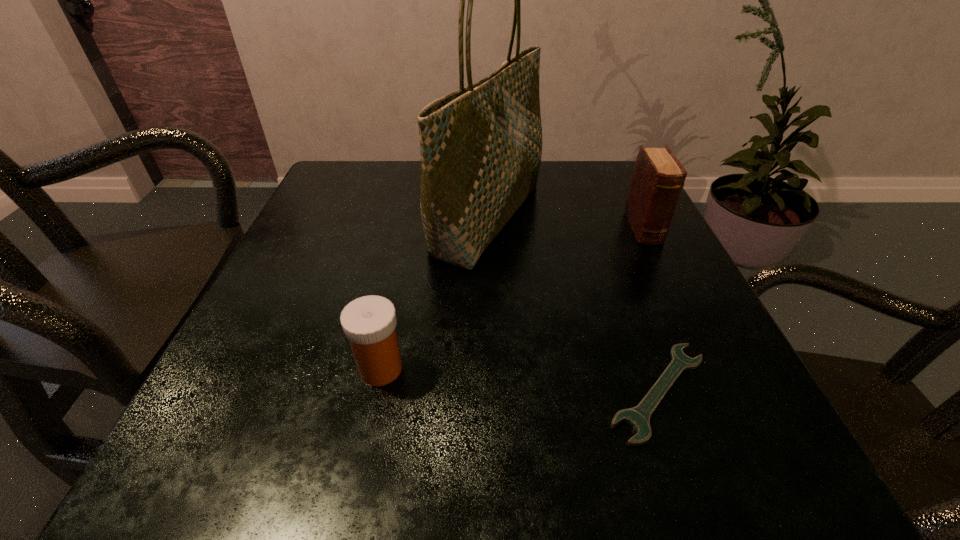
Where is `shopping bag present at the far edge`? This screenshot has width=960, height=540. shopping bag present at the far edge is located at coordinates (481, 146).

Image resolution: width=960 pixels, height=540 pixels. Identify the location of diary that is at the far edge. (658, 177).

This screenshot has height=540, width=960. What are the coordinates of `object located at the near edge` in the screenshot? It's located at (638, 417).

At what (x,y) coordinates should I click in order to perform the action: click on diary located at the right edge. Please return your answer as a coordinate pair (x, y). Looking at the image, I should click on (658, 177).

Identify the location of wrench that is at the right edge. (638, 417).

At what (x,y) coordinates should I click in order to perform the action: click on object situated at the far right corner. Please return your answer as a coordinate pair (x, y). The height and width of the screenshot is (540, 960). Looking at the image, I should click on (658, 177).

Locate an element on the screen. Image resolution: width=960 pixels, height=540 pixels. object at the near right corner is located at coordinates (638, 417).

The image size is (960, 540). What are the coordinates of `vacant area at the far edge` in the screenshot? It's located at (412, 180).

Where is `free space at the left edge of the desktop`? Image resolution: width=960 pixels, height=540 pixels. free space at the left edge of the desktop is located at coordinates (306, 334).

Find the location of a particular element. Image resolution: width=960 pixels, height=540 pixels. free space at the right edge of the desktop is located at coordinates (599, 255).